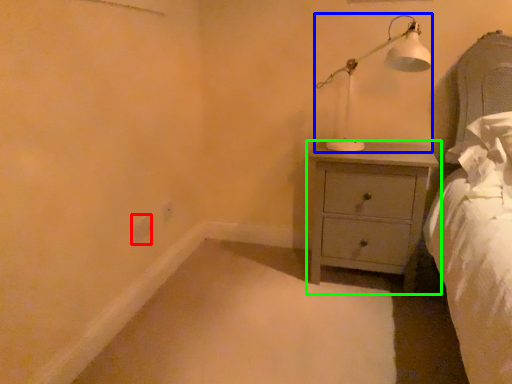
Question: Which is farther away from electric outlet (highlighted by a red box)? table lamp (highlighted by a blue box) or chest of drawers (highlighted by a green box)?

Choices:
 (A) table lamp
 (B) chest of drawers

Answer: (A)